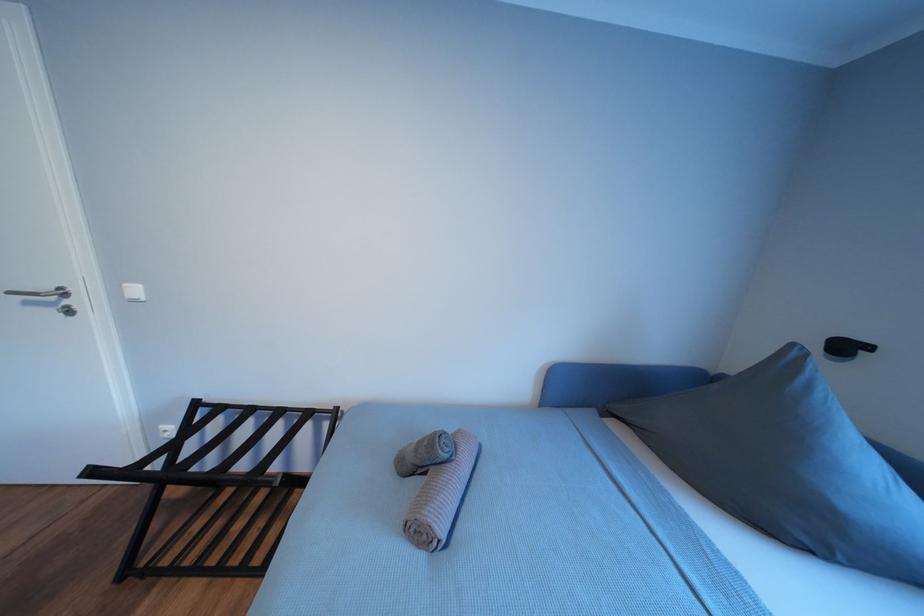
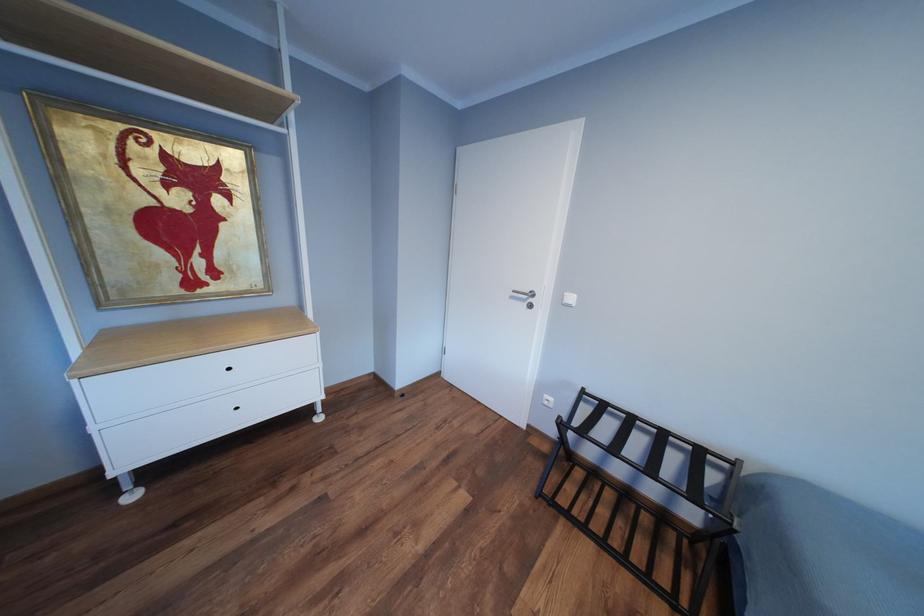
Question: Based on the continuous images, in which direction is the camera rotating? Reply with the corresponding letter.

Choices:
 (A) Left
 (B) Right
 (C) Up
 (D) Down

Answer: (A)